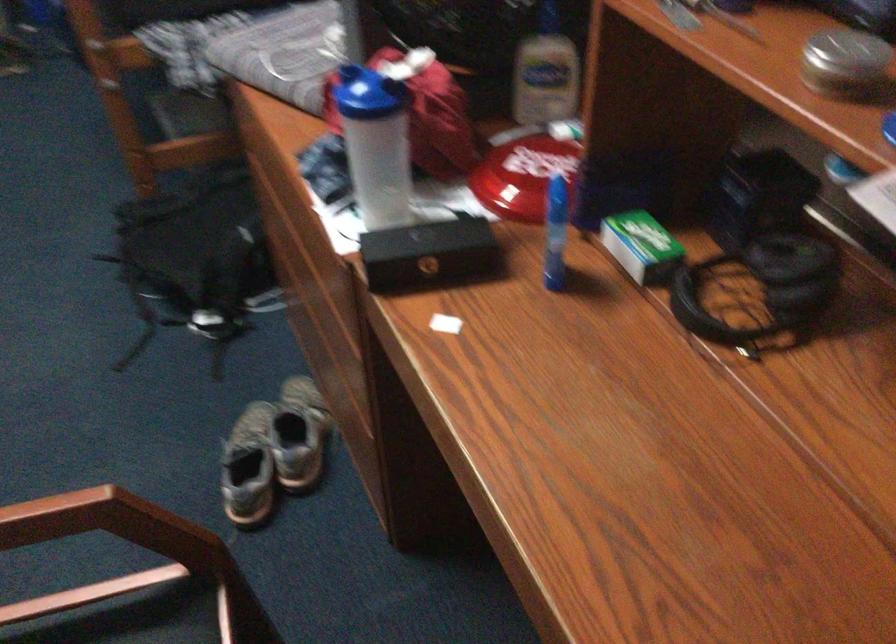
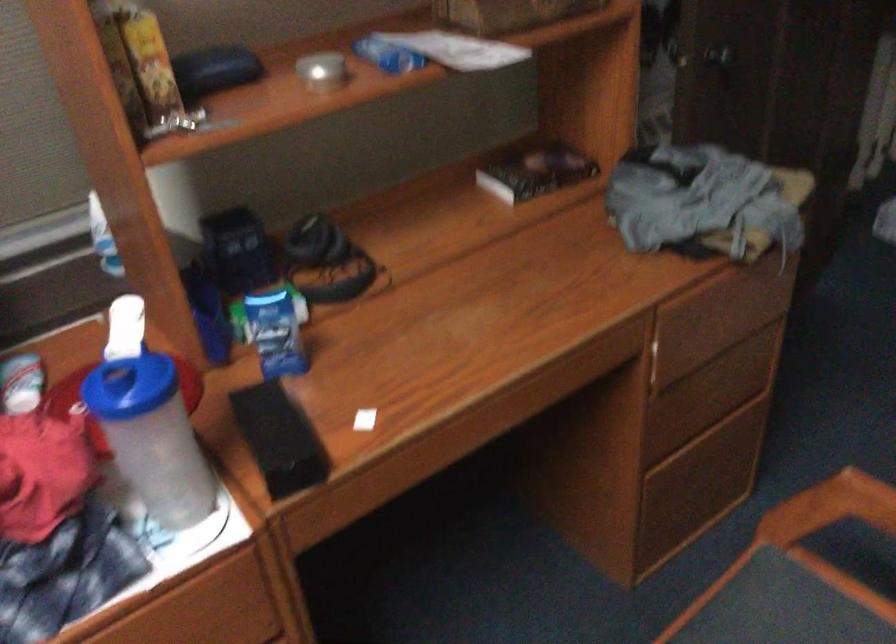
The point at (x=401, y=256) is marked in the first image. Where is the corresponding point in the second image?

(279, 438)